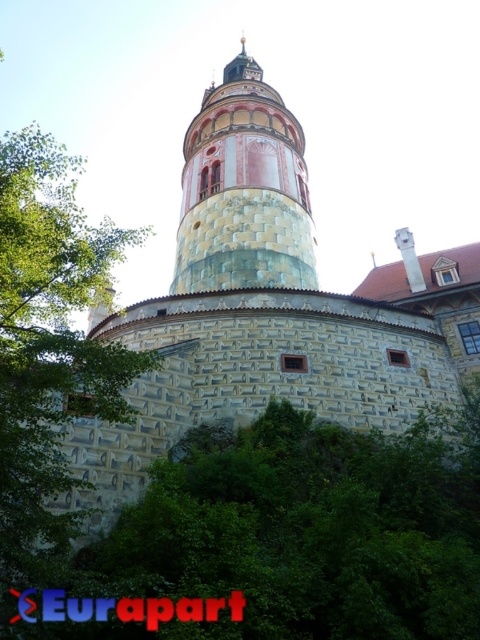
Who is shorter, green leafy tree at lower center or stone tower at center?

green leafy tree at lower center is shorter.

Which is in front, point (370, 564) or point (211, 163)?

Point (370, 564) is more forward.

Is point (455, 515) farther from viewer compared to point (186, 152)?

That is False.

Locate an element on the screen. green leafy tree at lower center is located at coordinates (307, 529).